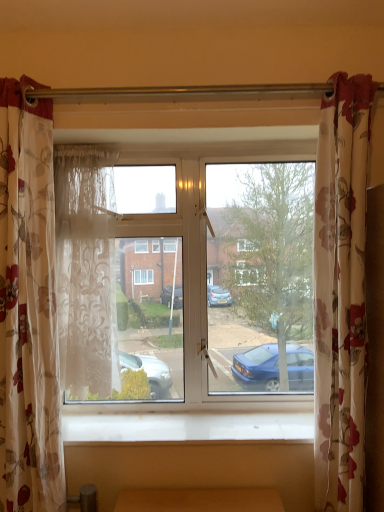
Where is `white wood at lower center`? This screenshot has width=384, height=512. white wood at lower center is located at coordinates (186, 426).

Does floral fabric curtain at right, which is the 1th curtain from right to left, have a lesser height compared to clear glass window at center?

No.

In the scene shown: Is floral fabric curtain at right, which is the 1th curtain from right to left, smaller than clear glass window at center?

Yes.

How distant is floral fabric curtain at right, which is the 1th curtain from right to left, from clear glass window at center?

floral fabric curtain at right, which is the 1th curtain from right to left, is 17.40 inches from clear glass window at center.

In the scene shown: Which object is positioned more to the right, floral fabric curtain at right, which is the 1th curtain from right to left, or clear glass window at center?

From the viewer's perspective, floral fabric curtain at right, which is the 1th curtain from right to left, appears more on the right side.

Is floral fabric curtain at left, the 3th curtain when ordered from right to left, wider or thinner than floral fabric curtain at right, the 3th curtain when ordered from left to right?

In the image, floral fabric curtain at left, the 3th curtain when ordered from right to left, appears to be wider than floral fabric curtain at right, the 3th curtain when ordered from left to right.

In the scene shown: Is the position of floral fabric curtain at left, which is the 1th curtain in left-to-right order, more distant than that of floral fabric curtain at right, which is the 1th curtain from right to left?

No, floral fabric curtain at left, which is the 1th curtain in left-to-right order, is in front of floral fabric curtain at right, which is the 1th curtain from right to left.

From a real-world perspective, who is located lower, floral fabric curtain at left, the 3th curtain when ordered from right to left, or floral fabric curtain at right, the 3th curtain when ordered from left to right?

floral fabric curtain at right, the 3th curtain when ordered from left to right.

Based on the photo, which point is more forward, [20,402] or [362,95]?

The point [362,95] is closer to the camera.

Which is behind, point (344, 108) or point (69, 356)?

The point (69, 356) is more distant.

How distant is floral fabric curtain at right, the 3th curtain when ordered from left to right, from sheer floral fabric curtain at left, which ranks as the 2th curtain in left-to-right order?

floral fabric curtain at right, the 3th curtain when ordered from left to right, and sheer floral fabric curtain at left, which ranks as the 2th curtain in left-to-right order, are 29.62 inches apart.

Does floral fabric curtain at right, which is the 1th curtain from right to left, have a lesser width compared to sheer floral fabric curtain at left, which ranks as the 2th curtain in right-to-left order?

In fact, floral fabric curtain at right, which is the 1th curtain from right to left, might be wider than sheer floral fabric curtain at left, which ranks as the 2th curtain in right-to-left order.

Is floral fabric curtain at right, the 3th curtain when ordered from left to right, situated inside sheer floral fabric curtain at left, which ranks as the 2th curtain in right-to-left order, or outside?

floral fabric curtain at right, the 3th curtain when ordered from left to right, lies outside sheer floral fabric curtain at left, which ranks as the 2th curtain in right-to-left order.

Identify the location of curtain that is the 2nd object to the right of the floral fabric curtain at left, which is the 1th curtain in left-to-right order, starting at the anchor. (341, 293).

From the picture: From the image's perspective, which object appears higher, floral fabric curtain at right, the 3th curtain when ordered from left to right, or floral fabric curtain at left, the 3th curtain when ordered from right to left?

floral fabric curtain at right, the 3th curtain when ordered from left to right, is shown above in the image.

Is floral fabric curtain at right, the 3th curtain when ordered from left to right, inside or outside of floral fabric curtain at left, the 3th curtain when ordered from right to left?

floral fabric curtain at right, the 3th curtain when ordered from left to right, is located beyond the bounds of floral fabric curtain at left, the 3th curtain when ordered from right to left.

From the picture: Is clear glass window at center with sheer floral fabric curtain at left, which ranks as the 2th curtain in right-to-left order?

clear glass window at center and sheer floral fabric curtain at left, which ranks as the 2th curtain in right-to-left order, are clearly separated.

Can you confirm if clear glass window at center is shorter than sheer floral fabric curtain at left, which ranks as the 2th curtain in right-to-left order?

In fact, clear glass window at center may be taller than sheer floral fabric curtain at left, which ranks as the 2th curtain in right-to-left order.

Is point (178, 182) positioned after point (83, 388)?

Yes.

Considering the sizes of objects clear glass window at center and sheer floral fabric curtain at left, which ranks as the 2th curtain in right-to-left order, in the image provided, who is bigger, clear glass window at center or sheer floral fabric curtain at left, which ranks as the 2th curtain in right-to-left order,?

clear glass window at center is bigger.

Is white wood at lower center spatially inside floral fabric curtain at right, which is the 1th curtain from right to left, or outside of it?

white wood at lower center exists outside the volume of floral fabric curtain at right, which is the 1th curtain from right to left.

Which of these two, white wood at lower center or floral fabric curtain at right, which is the 1th curtain from right to left, is bigger?

Bigger between the two is floral fabric curtain at right, which is the 1th curtain from right to left.

Considering the points (86, 421) and (330, 456), which point is behind, point (86, 421) or point (330, 456)?

The point (86, 421) is behind.

Which of these two, floral fabric curtain at right, the 3th curtain when ordered from left to right, or white wood at lower center, stands shorter?

white wood at lower center.

From a real-world perspective, who is located lower, floral fabric curtain at right, which is the 1th curtain from right to left, or white wood at lower center?

From a 3D spatial view, white wood at lower center is below.

Is there a large distance between floral fabric curtain at right, the 3th curtain when ordered from left to right, and white wood at lower center?

No, floral fabric curtain at right, the 3th curtain when ordered from left to right, is not far away from white wood at lower center.

Find the location of a particular element. The image size is (384, 512). curtain that is the 2nd object directly below the clear glass window at center (from a real-world perspective) is located at coordinates (341, 293).

The image size is (384, 512). Identify the location of the 1st curtain behind the floral fabric curtain at left, the 3th curtain when ordered from right to left. (341, 293).

From the image, which object appears to be farther from floral fabric curtain at left, which is the 1th curtain in left-to-right order, clear glass window at center or white wood at lower center?

Among the two, white wood at lower center is located further to floral fabric curtain at left, which is the 1th curtain in left-to-right order.

Estimate the real-world distances between objects in this image. Which object is closer to floral fabric curtain at right, which is the 1th curtain from right to left, clear glass window at center or floral fabric curtain at left, which is the 1th curtain in left-to-right order?

clear glass window at center.

Which object lies further to the anchor point clear glass window at center, sheer floral fabric curtain at left, which ranks as the 2th curtain in right-to-left order, or floral fabric curtain at left, which is the 1th curtain in left-to-right order?

floral fabric curtain at left, which is the 1th curtain in left-to-right order, is further to clear glass window at center.

Looking at the image, which one is located closer to white wood at lower center, clear glass window at center or floral fabric curtain at left, which is the 1th curtain in left-to-right order?

Among the two, clear glass window at center is located nearer to white wood at lower center.

Looking at this image, which object lies further to the anchor point clear glass window at center, sheer floral fabric curtain at left, which ranks as the 2th curtain in right-to-left order, or white wood at lower center?

white wood at lower center is positioned further to the anchor clear glass window at center.

Estimate the real-world distances between objects in this image. Which object is further from sheer floral fabric curtain at left, which ranks as the 2th curtain in left-to-right order, white wood at lower center or clear glass window at center?

white wood at lower center is further to sheer floral fabric curtain at left, which ranks as the 2th curtain in left-to-right order.

Which object lies further to the anchor point floral fabric curtain at left, the 3th curtain when ordered from right to left, sheer floral fabric curtain at left, which ranks as the 2th curtain in right-to-left order, or clear glass window at center?

The object further to floral fabric curtain at left, the 3th curtain when ordered from right to left, is clear glass window at center.

Looking at this image, from the image, which object appears to be nearer to clear glass window at center, floral fabric curtain at right, which is the 1th curtain from right to left, or sheer floral fabric curtain at left, which ranks as the 2th curtain in left-to-right order?

Based on the image, sheer floral fabric curtain at left, which ranks as the 2th curtain in left-to-right order, appears to be nearer to clear glass window at center.

The width and height of the screenshot is (384, 512). I want to click on window sill between floral fabric curtain at left, the 3th curtain when ordered from right to left, and floral fabric curtain at right, which is the 1th curtain from right to left, from left to right, so click(x=186, y=426).

I want to click on window between sheer floral fabric curtain at left, which ranks as the 2th curtain in right-to-left order, and white wood at lower center from top to bottom, so click(214, 285).

Where is `curtain located between floral fabric curtain at left, which is the 1th curtain in left-to-right order, and floral fabric curtain at right, which is the 1th curtain from right to left, in the left-right direction`? The image size is (384, 512). curtain located between floral fabric curtain at left, which is the 1th curtain in left-to-right order, and floral fabric curtain at right, which is the 1th curtain from right to left, in the left-right direction is located at coordinates (86, 270).

Image resolution: width=384 pixels, height=512 pixels. I want to click on curtain between floral fabric curtain at left, the 3th curtain when ordered from right to left, and clear glass window at center, in the horizontal direction, so click(x=86, y=270).